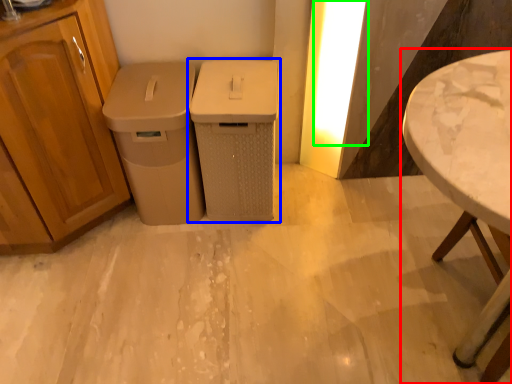
Question: Which is nearer to the table (highlighted by a red box)? waste container (highlighted by a blue box) or light (highlighted by a green box).

Choices:
 (A) waste container
 (B) light

Answer: (B)